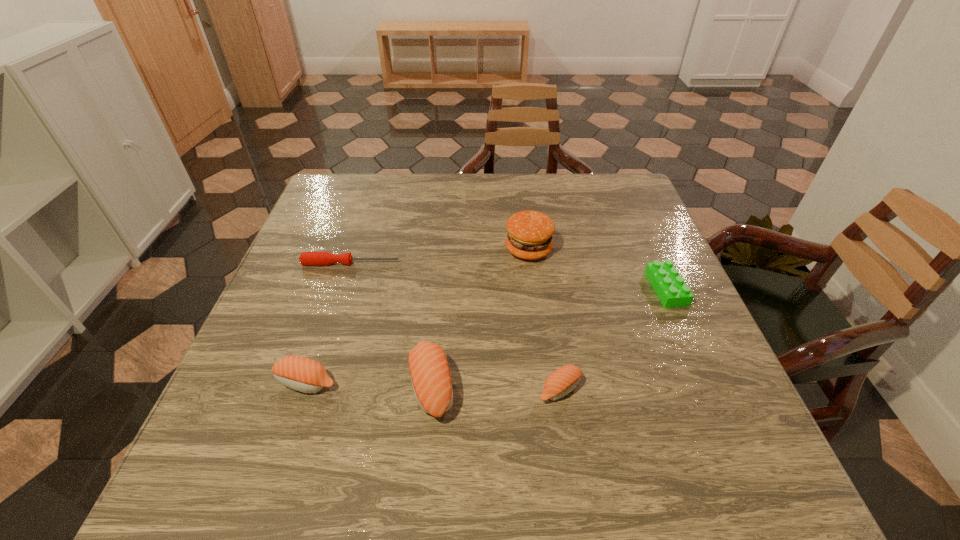
Image resolution: width=960 pixels, height=540 pixels. I want to click on vacant space that satisfies the following two spatial constraints: 1. at the tip of the shortest object; 2. on the right side of the rightmost object, so click(x=343, y=288).

In order to click on vacant space that satisfies the following two spatial constraints: 1. on the back side of the patty; 2. on the right side of the fourth shortest object in this screenshot , I will do `click(351, 249)`.

The image size is (960, 540). I want to click on vacant area in the image that satisfies the following two spatial constraints: 1. at the tip of the screwdriver; 2. on the right side of the fourth object from right to left, so click(x=311, y=386).